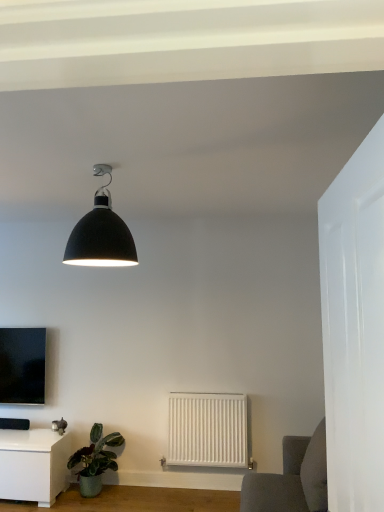
Question: Does matte black tv at left have a lesser height compared to white glossy table at lower left?

Choices:
 (A) yes
 (B) no

Answer: (B)

Question: From a real-world perspective, is matte black tv at left physically above white glossy table at lower left?

Choices:
 (A) yes
 (B) no

Answer: (A)

Question: Is white glossy table at lower left completely or partially inside matte black tv at left?

Choices:
 (A) yes
 (B) no

Answer: (B)

Question: Can you confirm if matte black tv at left is positioned to the right of white glossy table at lower left?

Choices:
 (A) no
 (B) yes

Answer: (A)

Question: Considering the relative sizes of matte black tv at left and white glossy table at lower left in the image provided, is matte black tv at left taller than white glossy table at lower left?

Choices:
 (A) no
 (B) yes

Answer: (B)

Question: Are matte black tv at left and white glossy table at lower left making contact?

Choices:
 (A) no
 (B) yes

Answer: (A)

Question: Is matte black tv at left surrounding white matte radiator at center?

Choices:
 (A) yes
 (B) no

Answer: (B)

Question: From the image's perspective, is matte black tv at left under white matte radiator at center?

Choices:
 (A) yes
 (B) no

Answer: (B)

Question: Is matte black tv at left in front of white matte radiator at center?

Choices:
 (A) no
 (B) yes

Answer: (A)

Question: Is matte black tv at left touching white matte radiator at center?

Choices:
 (A) yes
 (B) no

Answer: (B)

Question: Can you confirm if matte black tv at left is wider than white matte radiator at center?

Choices:
 (A) no
 (B) yes

Answer: (B)

Question: Can you confirm if matte black tv at left is taller than white matte radiator at center?

Choices:
 (A) yes
 (B) no

Answer: (A)

Question: From a real-world perspective, is matte black lampshade at upper center on top of white matte radiator at center?

Choices:
 (A) no
 (B) yes

Answer: (B)